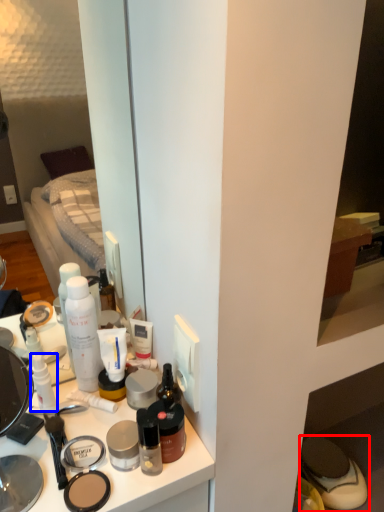
Question: Among these objects, which one is nearest to the camera, footwear (highlighted by a red box) or toiletry (highlighted by a blue box)?

Choices:
 (A) footwear
 (B) toiletry

Answer: (B)